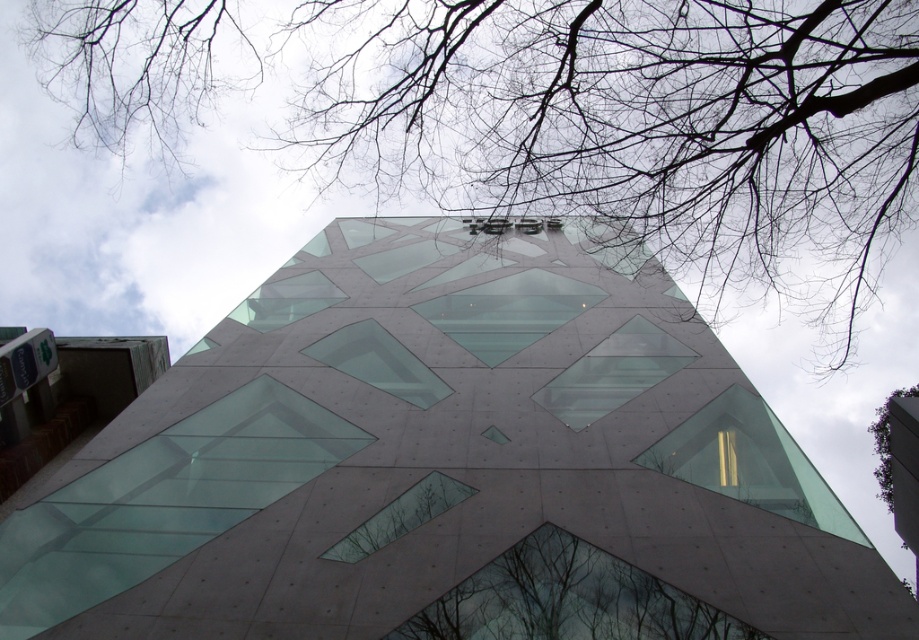
Is matte glass building at center shorter than bare branches at upper center?

No, matte glass building at center is not shorter than bare branches at upper center.

Does matte glass building at center appear on the left side of bare branches at upper center?

Correct, you'll find matte glass building at center to the left of bare branches at upper center.

Is point (712, 464) behind point (356, 147)?

No, it is not.

Locate an element on the screen. The height and width of the screenshot is (640, 919). matte glass building at center is located at coordinates (447, 465).

Between point (524, 19) and point (885, 433), which one is positioned in front?

Point (524, 19)

Can you confirm if bare branches at upper center is smaller than green leafy tree at upper right?

Indeed, bare branches at upper center has a smaller size compared to green leafy tree at upper right.

Does point (360, 141) come closer to viewer compared to point (887, 509)?

That is True.

Locate an element on the screen. This screenshot has width=919, height=640. bare branches at upper center is located at coordinates (562, 116).

Can you confirm if bare branches at upper center is positioned to the left of dark brown textured tree at bottom center?

No, bare branches at upper center is not to the left of dark brown textured tree at bottom center.

Based on the photo, is bare branches at upper center above dark brown textured tree at bottom center?

Yes, bare branches at upper center is above dark brown textured tree at bottom center.

Identify the location of bare branches at upper center. (562, 116).